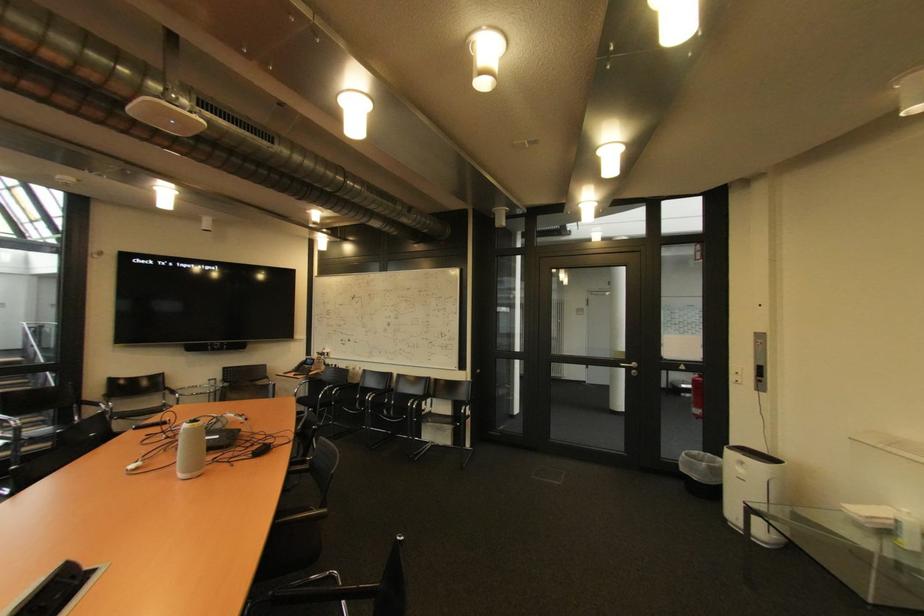
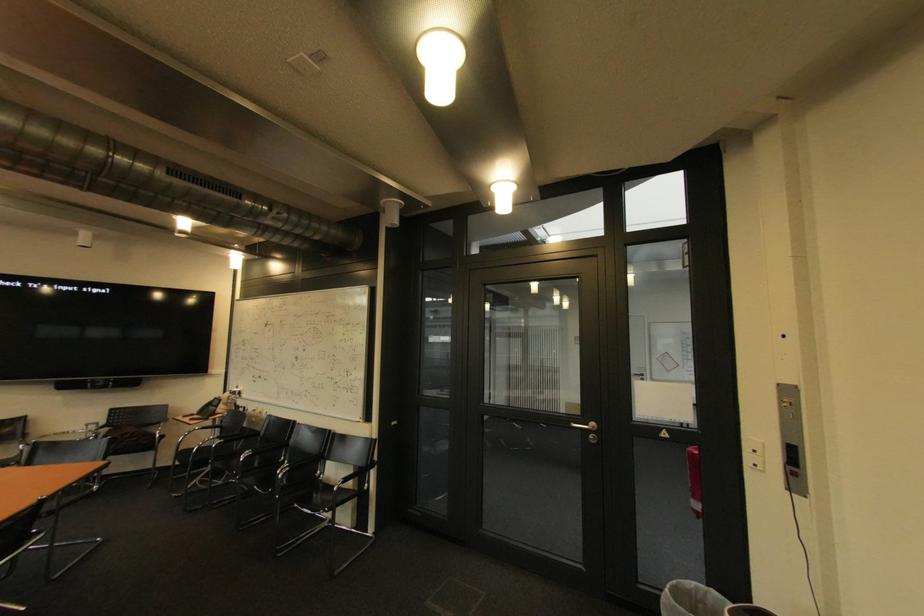
In the second image, find the point that corresponds to (x=704, y=454) in the first image.

(701, 585)